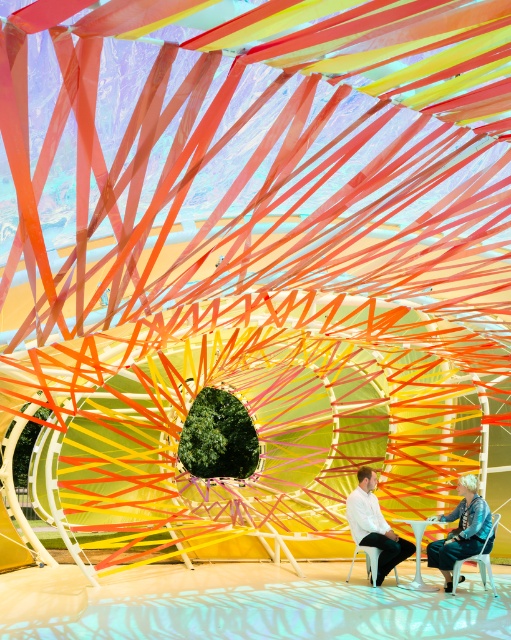
You are standing in the center of the installation and want to place a new decorative item. The installation has a coordinate system where the bottom left corner is the origin point. Where should you place the new item so that it is exactly 0.1 units to the right of the denim jacket at lower right?

The denim jacket at lower right is at point (460, 529). Adding 0.1 to the x coordinate gives 0.928, so the new item should be placed at (460, 593).

Based on the photo, you are sitting on the white plastic chair at lower right and want to move to the white plastic chair at lower center. Which direction should you move to get closer to the central circular structure?

The white plastic chair at lower right is closer to the viewer than the white plastic chair at lower center. To move towards the central circular structure, you should move forward towards the white plastic chair at lower center.

You are a visitor in this space and want to sit down on the white plastic chair at lower right. However, there is a denim jacket at lower right in the way. Can you sit on the chair without moving the jacket?

The denim jacket at lower right is bigger than the white plastic chair at lower right. Since the jacket is larger, it might be covering the chair entirely or partially, making it difficult to sit without moving it.